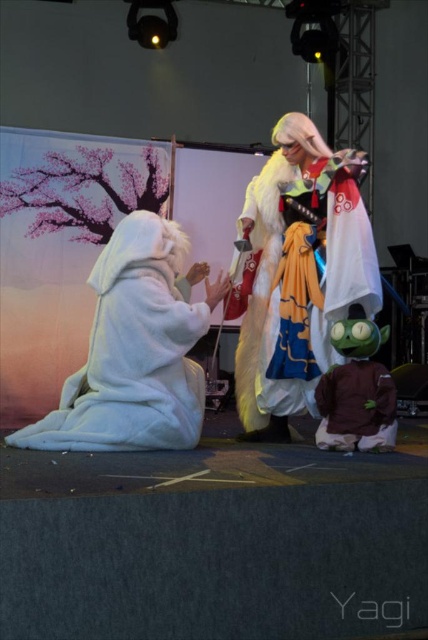
From the picture: Between multicolored fabric costume at center and brown plush toy at lower right, which one has more height?

With more height is multicolored fabric costume at center.

Which is in front, point (314, 340) or point (350, 426)?

Point (350, 426) is more forward.

Locate an element on the screen. Image resolution: width=428 pixels, height=640 pixels. multicolored fabric costume at center is located at coordinates (261, 285).

Does white fluffy robe at left appear on the right side of brown plush toy at lower right?

In fact, white fluffy robe at left is to the left of brown plush toy at lower right.

Image resolution: width=428 pixels, height=640 pixels. What do you see at coordinates (136, 349) in the screenshot?
I see `white fluffy robe at left` at bounding box center [136, 349].

Locate an element on the screen. The height and width of the screenshot is (640, 428). white fluffy robe at left is located at coordinates (136, 349).

Consider the image. Can you confirm if white fluffy robe at left is thinner than multicolored fabric costume at center?

Incorrect, white fluffy robe at left's width is not less than multicolored fabric costume at center's.

Who is more forward, (130, 419) or (261, 324)?

Point (130, 419)

This screenshot has height=640, width=428. Identify the location of white fluffy robe at left. (136, 349).